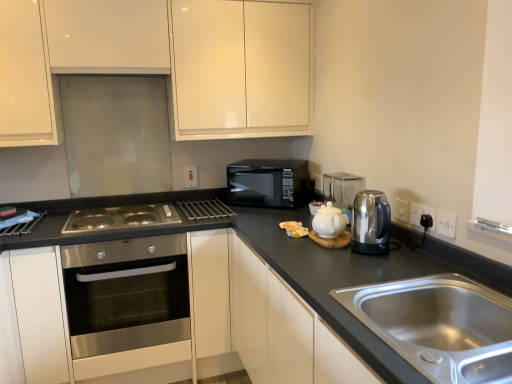
Question: Should I look upward or downward to see white glossy tea pot at center?

Choices:
 (A) down
 (B) up

Answer: (A)

Question: Is the position of satin metallic kettle at right, marked as the first appliance in a front-to-back arrangement, more distant than that of metallic silver rack at center, which is the 3th appliance from right to left?

Choices:
 (A) no
 (B) yes

Answer: (A)

Question: Does satin metallic kettle at right, the 3th appliance when ordered from back to front, have a lesser width compared to metallic silver rack at center, the 3th appliance from the front?

Choices:
 (A) yes
 (B) no

Answer: (A)

Question: Is satin metallic kettle at right, marked as the first appliance in a front-to-back arrangement, directly adjacent to metallic silver rack at center, which is the first appliance in back-to-front order?

Choices:
 (A) no
 (B) yes

Answer: (A)

Question: Is metallic silver rack at center, the 3th appliance from the front, at the back of satin metallic kettle at right, the 3th appliance when ordered from back to front?

Choices:
 (A) no
 (B) yes

Answer: (A)

Question: Is satin metallic kettle at right, arranged as the 3th appliance when viewed from the left, wider than metallic silver rack at center, which is the first appliance in back-to-front order?

Choices:
 (A) yes
 (B) no

Answer: (B)

Question: From the image's perspective, is satin metallic kettle at right, the 3th appliance when ordered from back to front, beneath metallic silver rack at center, which is the first appliance in back-to-front order?

Choices:
 (A) no
 (B) yes

Answer: (B)

Question: Considering the relative positions of black matte microwave at center and polished stainless steel cooktop at lower left in the image provided, is black matte microwave at center to the left of polished stainless steel cooktop at lower left from the viewer's perspective?

Choices:
 (A) yes
 (B) no

Answer: (B)

Question: Can you confirm if black matte microwave at center is wider than polished stainless steel cooktop at lower left?

Choices:
 (A) yes
 (B) no

Answer: (B)

Question: Is black matte microwave at center completely or partially outside of polished stainless steel cooktop at lower left?

Choices:
 (A) no
 (B) yes

Answer: (B)

Question: Is polished stainless steel cooktop at lower left a part of black matte microwave at center?

Choices:
 (A) no
 (B) yes

Answer: (A)

Question: Is black matte microwave at center thinner than polished stainless steel cooktop at lower left?

Choices:
 (A) no
 (B) yes

Answer: (B)

Question: From the image's perspective, is black matte microwave at center located above polished stainless steel cooktop at lower left?

Choices:
 (A) yes
 (B) no

Answer: (A)

Question: Can you confirm if stainless steel oven at center-left is wider than metallic silver rack at center, which is the first appliance in back-to-front order?

Choices:
 (A) no
 (B) yes

Answer: (B)